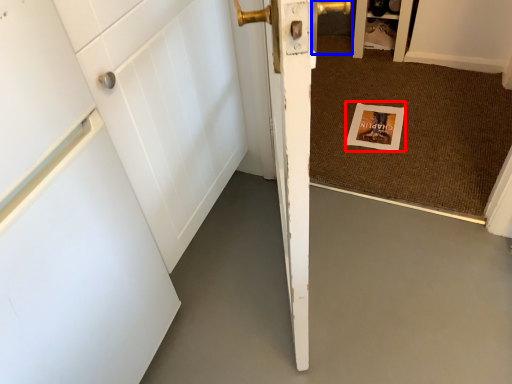
Question: Which of the following is the closest to the observer, postcard (highlighted by a red box) or door handle (highlighted by a blue box)?

Choices:
 (A) postcard
 (B) door handle

Answer: (A)